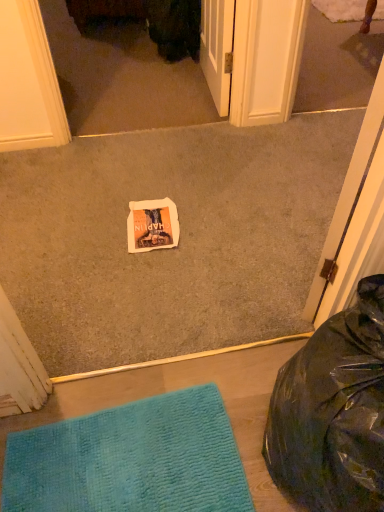
Question: Considering the relative positions of white paper at center and black plastic bean bag chair at lower right in the image provided, is white paper at center to the left of black plastic bean bag chair at lower right from the viewer's perspective?

Choices:
 (A) yes
 (B) no

Answer: (A)

Question: Is white paper at center closer to camera compared to black plastic bean bag chair at lower right?

Choices:
 (A) yes
 (B) no

Answer: (B)

Question: Is white paper at center facing towards black plastic bean bag chair at lower right?

Choices:
 (A) no
 (B) yes

Answer: (A)

Question: Can you confirm if white paper at center is smaller than black plastic bean bag chair at lower right?

Choices:
 (A) yes
 (B) no

Answer: (A)

Question: From a real-world perspective, is white paper at center physically below black plastic bean bag chair at lower right?

Choices:
 (A) no
 (B) yes

Answer: (B)

Question: Can you confirm if white paper at center is shorter than black plastic bean bag chair at lower right?

Choices:
 (A) yes
 (B) no

Answer: (A)

Question: From the image's perspective, is white paper at center under matte white screen door at upper center?

Choices:
 (A) yes
 (B) no

Answer: (A)

Question: Is white paper at center smaller than matte white screen door at upper center?

Choices:
 (A) no
 (B) yes

Answer: (B)

Question: From the image's perspective, is white paper at center over matte white screen door at upper center?

Choices:
 (A) yes
 (B) no

Answer: (B)

Question: Does white paper at center come in front of matte white screen door at upper center?

Choices:
 (A) no
 (B) yes

Answer: (B)

Question: Is white paper at center shorter than matte white screen door at upper center?

Choices:
 (A) no
 (B) yes

Answer: (B)

Question: Is white paper at center behind matte white screen door at upper center?

Choices:
 (A) yes
 (B) no

Answer: (B)

Question: Is white paper at center surrounding matte white screen door at upper center?

Choices:
 (A) no
 (B) yes

Answer: (A)